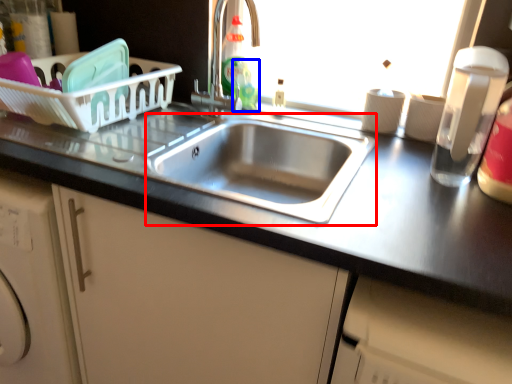
Question: Which point is closer to the camera, sink (highlighted by a red box) or bottle (highlighted by a blue box)?

Choices:
 (A) sink
 (B) bottle

Answer: (A)